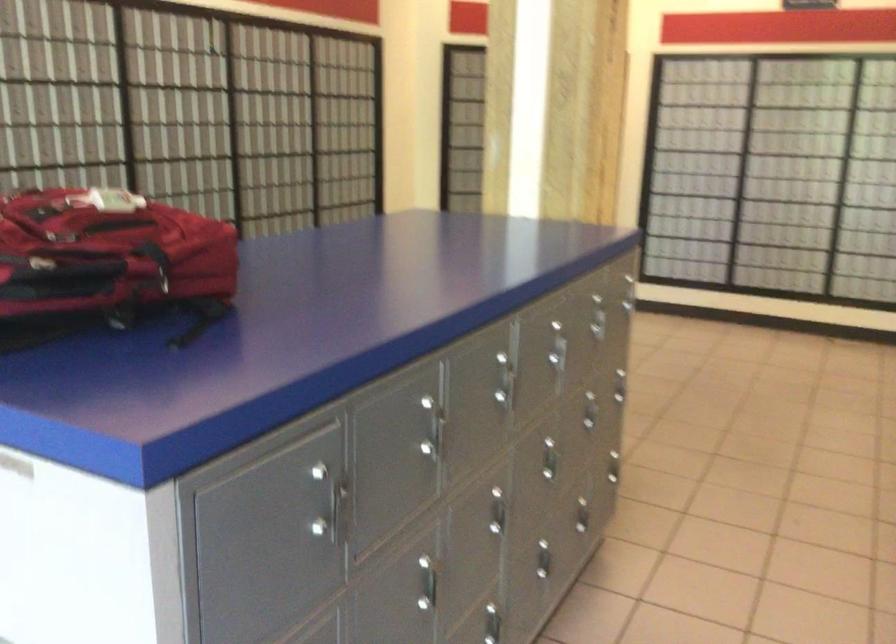
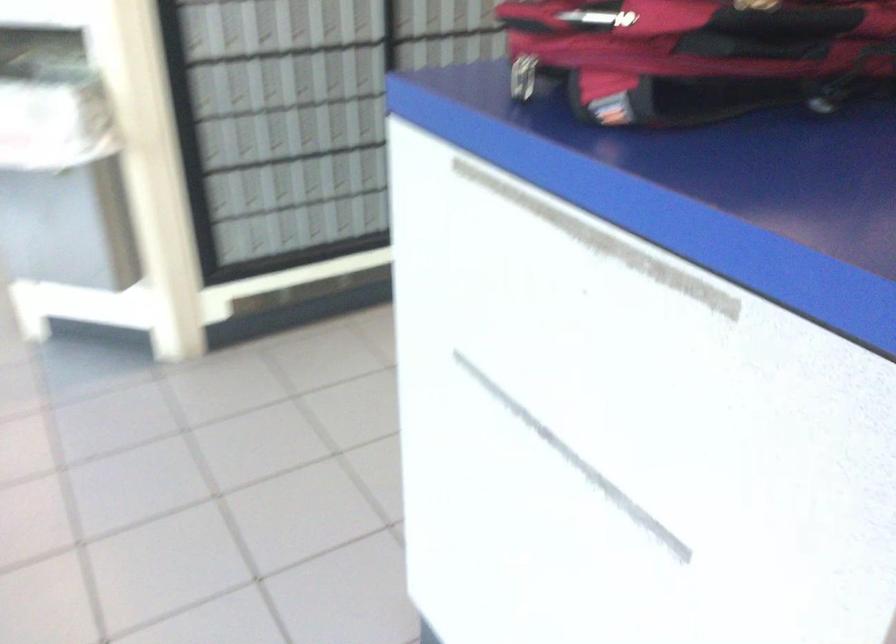
Based on the continuous images, in which direction is the camera rotating?

The camera's rotation is toward left-down.